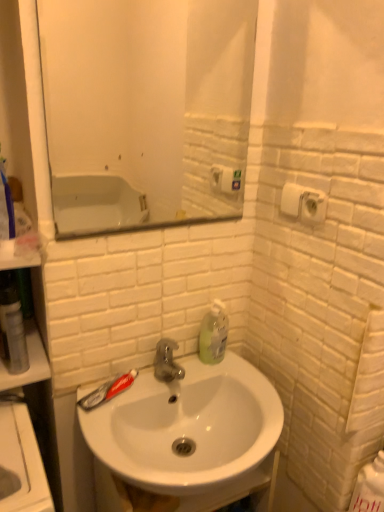
Identify the location of vacant area to the right of translucent plastic toothpaste at sink left. This screenshot has height=512, width=384. (169, 380).